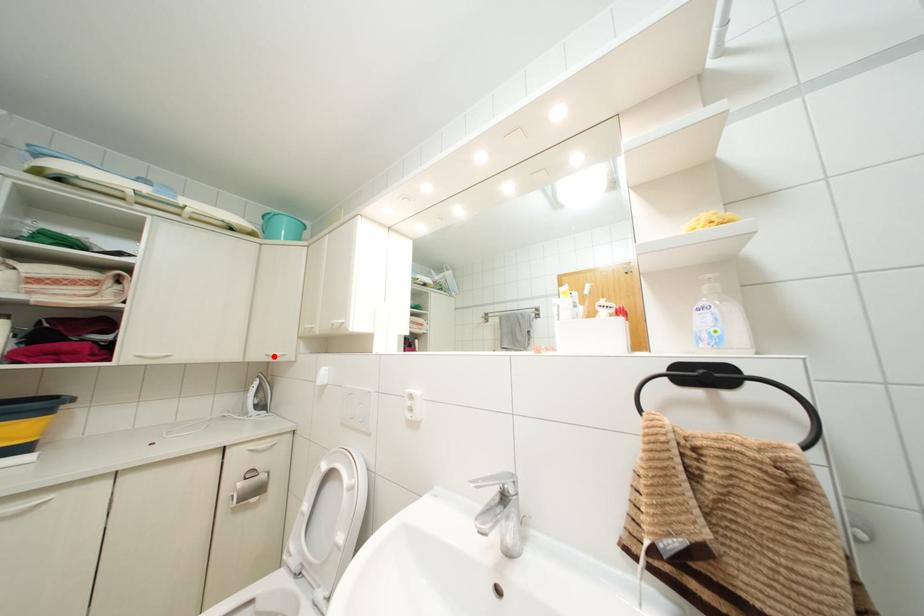
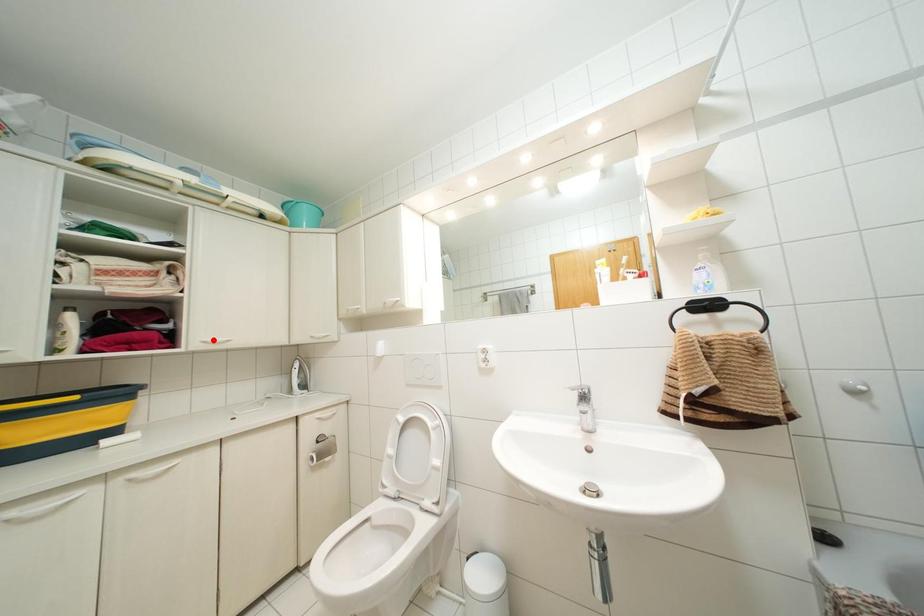
I am providing you with two images of the same scene from different viewpoints. A red point is marked on the first image and another point is marked on the second image. Does the point marked in image1 correspond to the same location as the one in image2?

No